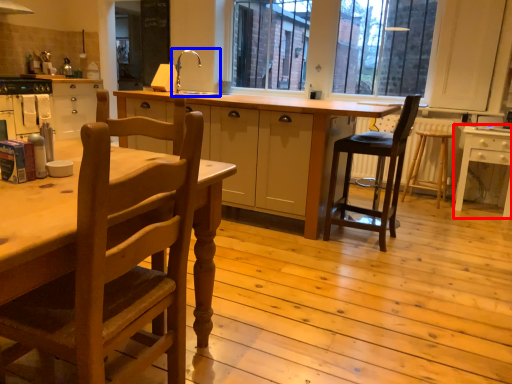
Question: Which object appears farthest to the camera in this image, table (highlighted by a red box) or sink (highlighted by a blue box)?

Choices:
 (A) table
 (B) sink

Answer: (B)